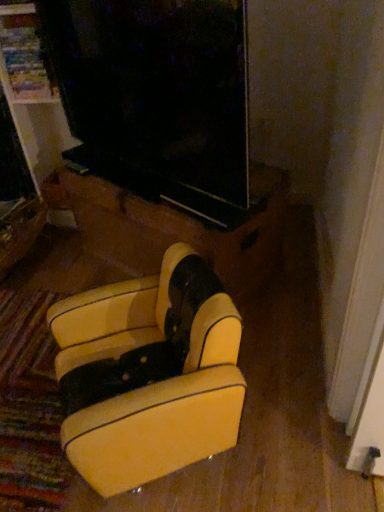
Question: Looking at their shapes, would you say wooden drawer at lower left is wider or thinner than yellow leather armchair at lower center, which ranks as the second furniture in back-to-front order?

Choices:
 (A) wide
 (B) thin

Answer: (A)

Question: Is point (31, 219) positioned closer to the camera than point (140, 376)?

Choices:
 (A) farther
 (B) closer

Answer: (A)

Question: Which object is the closest to the yellow leather armchair at lower center, which ranks as the second furniture in back-to-front order?

Choices:
 (A) leather armchair at center, which is the second furniture from front to back
 (B) wooden drawer at lower left

Answer: (A)

Question: Which of these objects is positioned farthest from the wooden drawer at lower left?

Choices:
 (A) leather armchair at center, which is the second furniture from front to back
 (B) yellow leather armchair at lower center, the 1th furniture viewed from the front

Answer: (B)